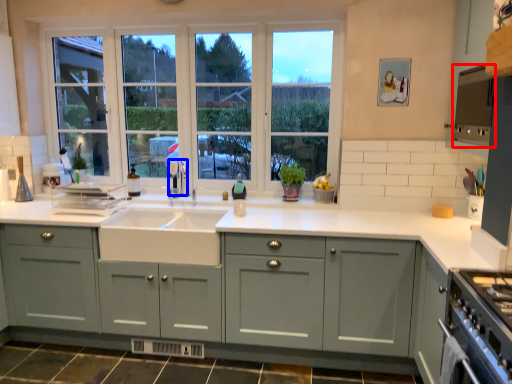
Question: Which point is further to the camera, appliance (highlighted by a red box) or faucet (highlighted by a blue box)?

Choices:
 (A) appliance
 (B) faucet

Answer: (B)